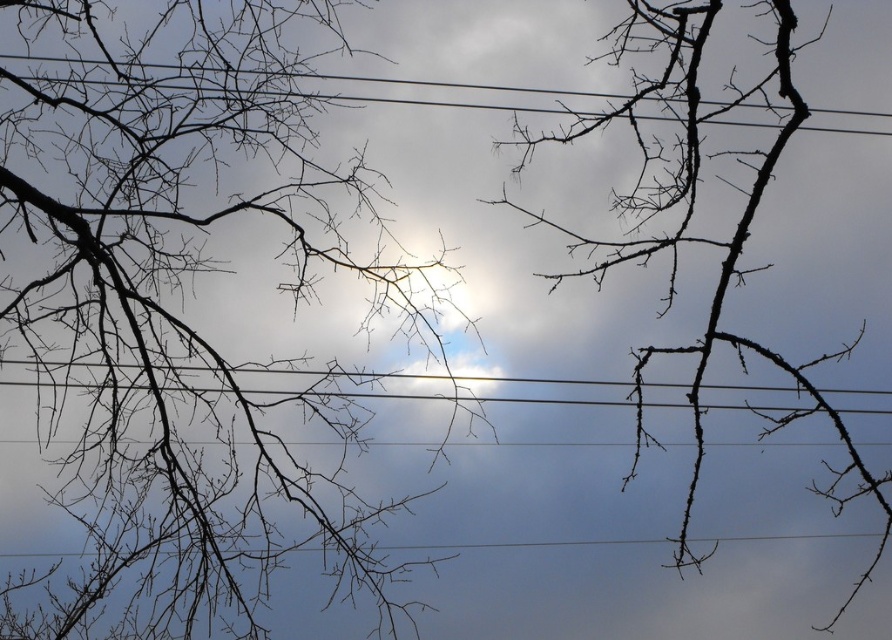
You are a bird flying in the sky and see two points in the image. The first is point at point (x=766, y=348) and the second is point at point (x=475, y=84). Which point is closer to you as you fly towards the center of the image?

Point at point (x=766, y=348) is closer to you because it is further to the viewer than point at point (x=475, y=84).

You are a bird trying to land on a branch. You see the dark brown branches at center. Where exactly would you land?

The dark brown branches at center are located at point (703, 237), so you should aim for that coordinate to land safely.

You are an electrician inspecting the power lines in the image. You notice the dark brown branches at center and the black wire at upper center. Which object is closer to you, the observer?

The dark brown branches at center is closer to you than the black wire at upper center, as it is in front of the wire.